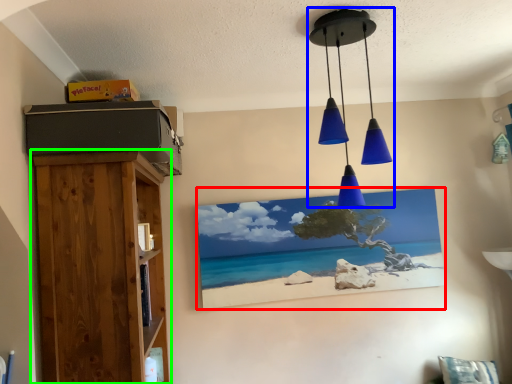
Question: Based on their relative distances, which object is farther from picture frame (highlighted by a red box)? Choose from lamp (highlighted by a blue box) and furniture (highlighted by a green box).

Choices:
 (A) lamp
 (B) furniture

Answer: (B)